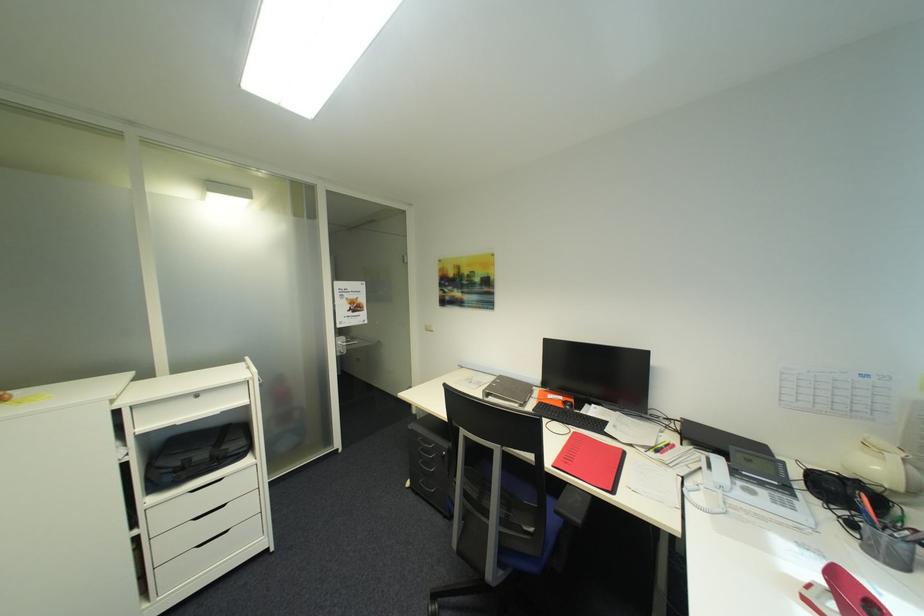
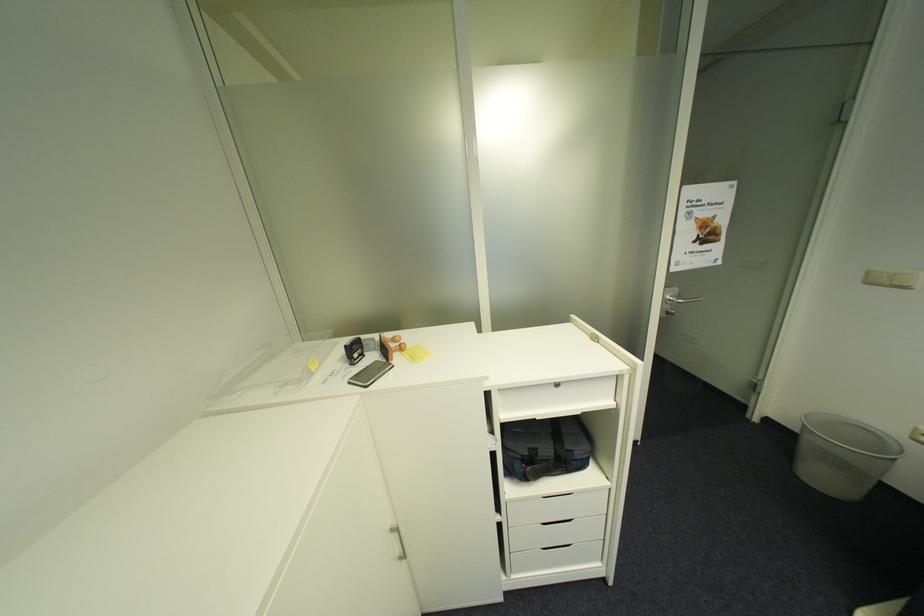
Locate, in the second image, the point that corresponds to (188,464) in the first image.

(535, 454)